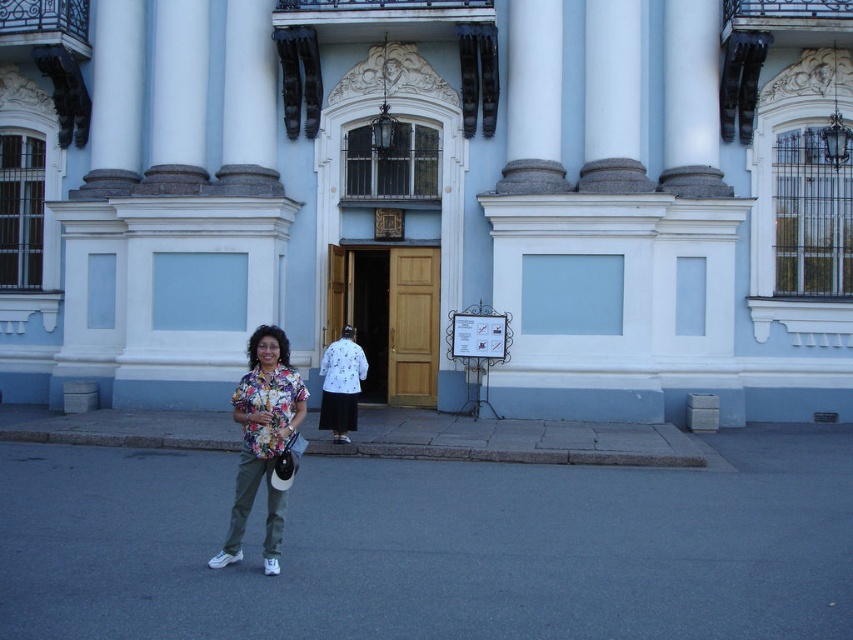
Question: Which point appears closest to the camera in this image?

Choices:
 (A) (247, 28)
 (B) (277, 396)

Answer: (B)

Question: Can you confirm if white marble column at upper left is wider than white dotted shirt at center?

Choices:
 (A) yes
 (B) no

Answer: (A)

Question: Does floral print shirt at center have a smaller size compared to white dotted shirt at center?

Choices:
 (A) no
 (B) yes

Answer: (A)

Question: Does white marble column at upper left have a smaller size compared to white dotted shirt at center?

Choices:
 (A) no
 (B) yes

Answer: (A)

Question: Which point is farther to the camera?

Choices:
 (A) (270, 452)
 (B) (341, 420)

Answer: (B)

Question: Which point is closer to the camera taking this photo?

Choices:
 (A) (247, 515)
 (B) (332, 353)
 (C) (268, 104)

Answer: (A)